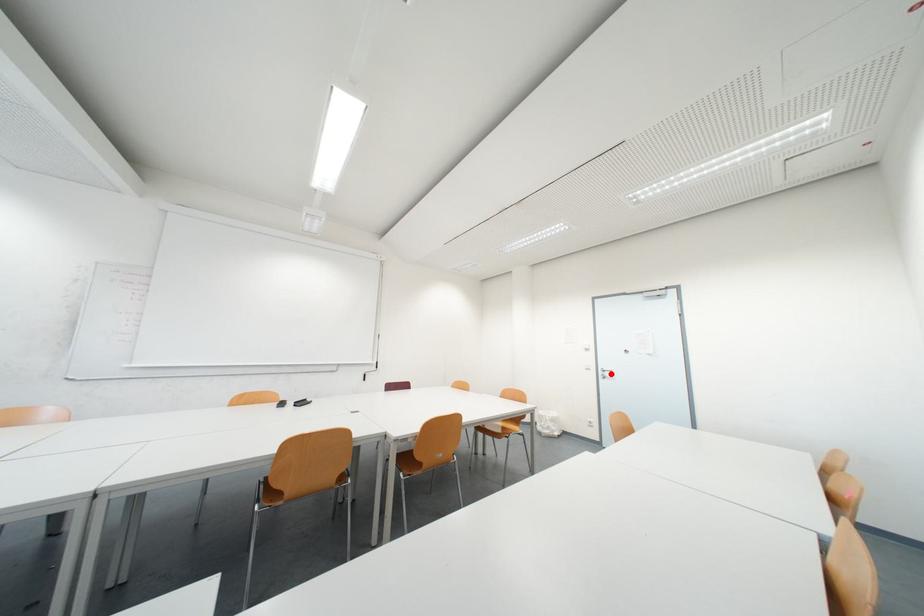
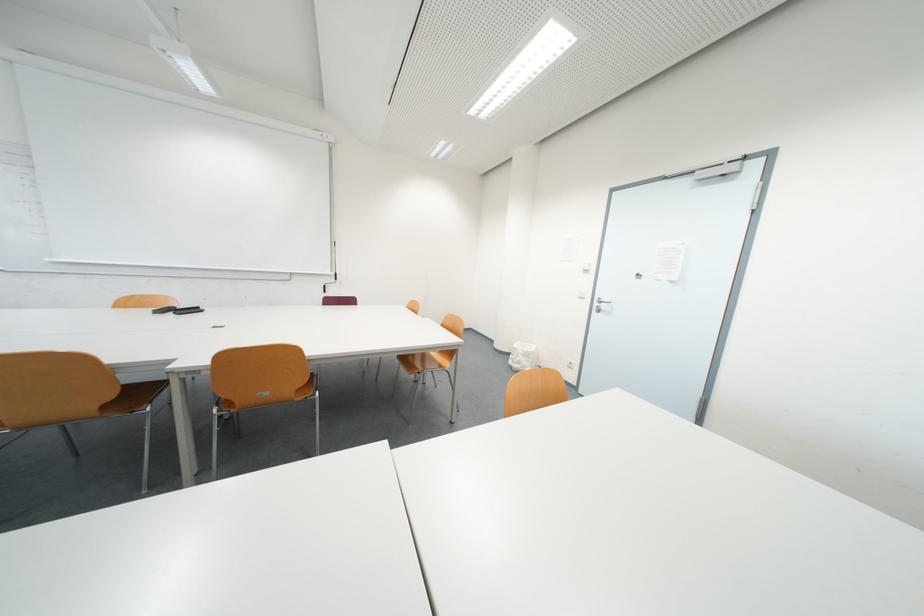
Locate, in the second image, the point that corresponds to the highlighted location in the first image.

(605, 305)